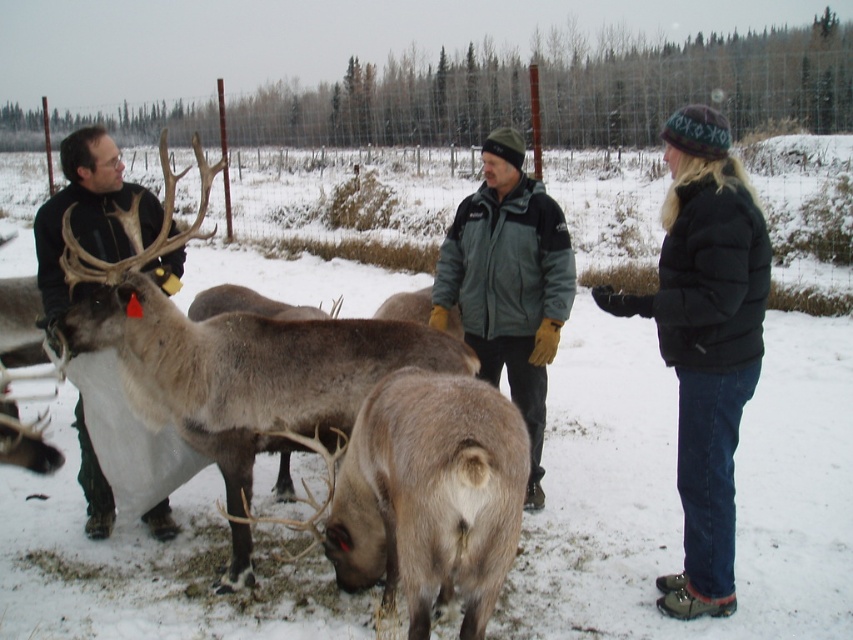
Who is higher up, brown fur reindeer at center or gray fleece jacket at center?

A: gray fleece jacket at center

Does brown fur reindeer at center have a smaller size compared to gray fleece jacket at center?

No.

This screenshot has width=853, height=640. In order to click on brown fur reindeer at center in this screenshot , I will do `click(248, 376)`.

Locate an element on the screen. The image size is (853, 640). brown fur reindeer at center is located at coordinates (248, 376).

Where is `brown fur reindeer at center`? brown fur reindeer at center is located at coordinates (248, 376).

Does brown fur reindeer at center appear over black puffy jacket at right?

Actually, brown fur reindeer at center is below black puffy jacket at right.

Which is behind, point (345, 396) or point (691, 426)?

Point (345, 396)

Where is `brown fur reindeer at center`? Image resolution: width=853 pixels, height=640 pixels. brown fur reindeer at center is located at coordinates (248, 376).

Can you confirm if gray fleece jacket at center is positioned to the left of matte black jacket at left?

Incorrect, gray fleece jacket at center is not on the left side of matte black jacket at left.

Locate an element on the screen. gray fleece jacket at center is located at coordinates (508, 284).